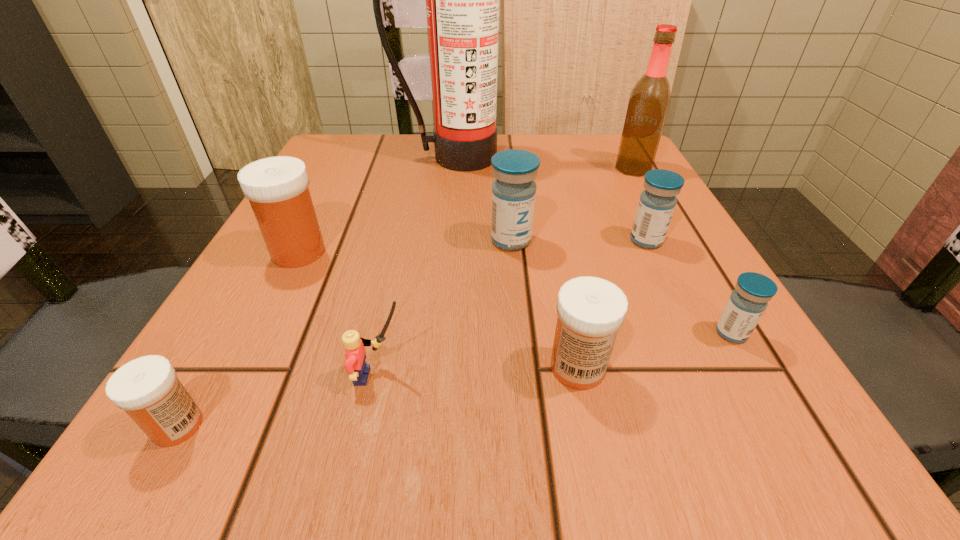
Identify the location of vacant point at the near edge. The height and width of the screenshot is (540, 960). (595, 408).

Locate an element on the screen. free space at the left edge of the desktop is located at coordinates (305, 329).

In the image, there is a desktop. In order to click on vacant space at the far left corner in this screenshot , I will do `click(352, 166)`.

This screenshot has height=540, width=960. In the image, there is a desktop. In order to click on free region at the far right corner in this screenshot , I will do `click(636, 179)`.

Identify the location of vacant region at the near right corner. (785, 473).

The image size is (960, 540). What are the coordinates of `blank region between the nearest white medicine and the biggest white medicine` in the screenshot? It's located at (238, 339).

This screenshot has width=960, height=540. Identify the location of empty location between the rightmost white medicine and the Lego. (478, 372).

Locate an element on the screen. The width and height of the screenshot is (960, 540). vacant point located between the Lego and the farthest white medicine is located at coordinates point(339,314).

The width and height of the screenshot is (960, 540). Find the location of `free space that is in between the rightmost medicine and the nearest white medicine`. free space that is in between the rightmost medicine and the nearest white medicine is located at coordinates (454, 380).

Identify the location of vacant space in between the second blue medicine from right to left and the tallest object. This screenshot has width=960, height=540. (549, 199).